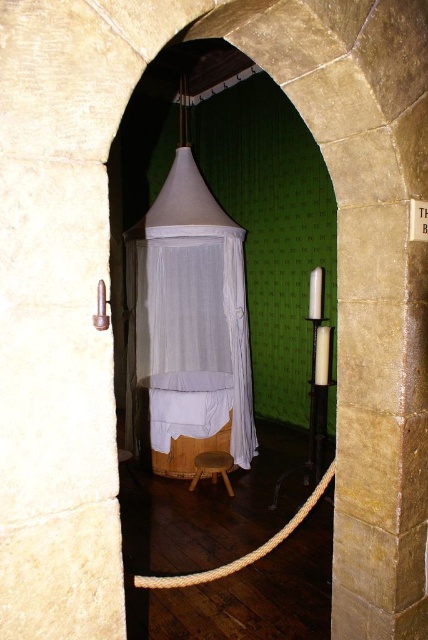
Question: Does white fabric canopy bed at center have a larger size compared to light brown wooden stool at center?

Choices:
 (A) yes
 (B) no

Answer: (A)

Question: Estimate the real-world distances between objects in this image. Which object is farther from the white fabric canopy bed at center?

Choices:
 (A) light brown wooden stool at center
 (B) white rope at center

Answer: (B)

Question: Which object is closer to the camera taking this photo?

Choices:
 (A) white fabric canopy bed at center
 (B) light brown wooden stool at center
 (C) white rope at center

Answer: (C)

Question: In this image, where is white rope at center located relative to light brown wooden stool at center?

Choices:
 (A) left
 (B) right

Answer: (B)

Question: Does white fabric canopy bed at center come behind white rope at center?

Choices:
 (A) no
 (B) yes

Answer: (B)

Question: Which of the following is the closest to the observer?

Choices:
 (A) white fabric canopy bed at center
 (B) white rope at center
 (C) light brown wooden stool at center

Answer: (B)